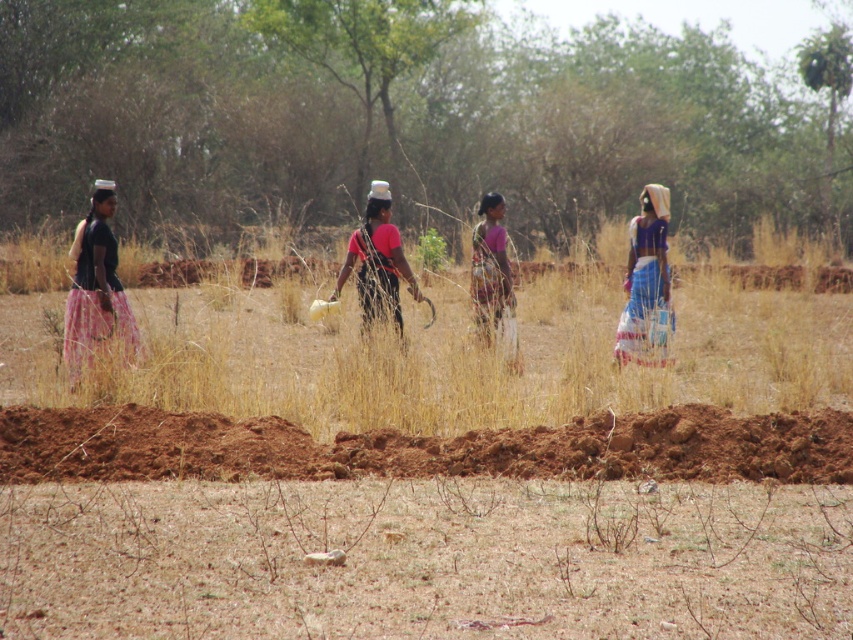
Is brown soil at lower center thinner than matte pink skirt at left?

In fact, brown soil at lower center might be wider than matte pink skirt at left.

Who is shorter, brown soil at lower center or matte pink skirt at left?

brown soil at lower center is shorter.

Who is more forward, (146, 493) or (105, 321)?

Point (146, 493)

The height and width of the screenshot is (640, 853). Identify the location of brown soil at lower center. 424,560.

Which is in front, point (558, 624) or point (630, 275)?

Positioned in front is point (558, 624).

Does brown soil at lower center have a greater height compared to blue fabric skirt at right?

No.

Image resolution: width=853 pixels, height=640 pixels. What are the coordinates of `brown soil at lower center` in the screenshot? It's located at (424, 560).

The width and height of the screenshot is (853, 640). I want to click on brown soil at lower center, so click(x=424, y=560).

Who is positioned more to the right, brown dry grass at center or matte pink skirt at left?

From the viewer's perspective, brown dry grass at center appears more on the right side.

The image size is (853, 640). What are the coordinates of `brown dry grass at center` in the screenshot? It's located at pos(444,356).